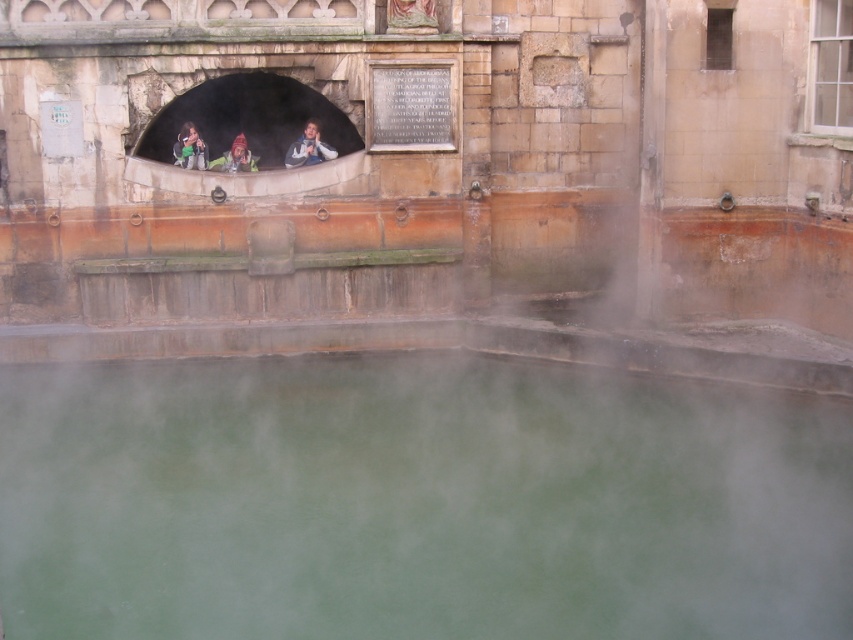
Does light brown leather jacket at upper center appear on the right side of green fabric jacket at upper center?

Correct, you'll find light brown leather jacket at upper center to the right of green fabric jacket at upper center.

Is light brown leather jacket at upper center in front of green fabric jacket at upper center?

That is False.

Image resolution: width=853 pixels, height=640 pixels. What do you see at coordinates (308, 147) in the screenshot?
I see `light brown leather jacket at upper center` at bounding box center [308, 147].

You are a GUI agent. You are given a task and a screenshot of the screen. Output one action in this format:
    pyautogui.click(x=<x>, y=<y>)
    Task: Click on the light brown leather jacket at upper center
    This screenshot has width=853, height=640.
    Given the screenshot: What is the action you would take?
    pyautogui.click(x=308, y=147)

Which is behind, point (326, 412) or point (201, 161)?

The point (201, 161) is more distant.

Does green opaque water at center have a greater height compared to green fabric jacket at upper center?

Correct, green opaque water at center is much taller as green fabric jacket at upper center.

Is point (753, 422) positioned behind point (198, 134)?

No, it is not.

This screenshot has height=640, width=853. In order to click on green opaque water at center in this screenshot , I will do `click(416, 500)`.

Is green opaque water at center bigger than reddish-brown fur hat at center?

Yes, green opaque water at center is bigger than reddish-brown fur hat at center.

Between point (343, 381) and point (248, 156), which one is positioned behind?

The point (248, 156) is more distant.

Which is in front, point (341, 627) or point (238, 132)?

Point (341, 627) is in front.

At what (x,y) coordinates should I click in order to perform the action: click on green opaque water at center. Please return your answer as a coordinate pair (x, y). The image size is (853, 640). Looking at the image, I should click on (x=416, y=500).